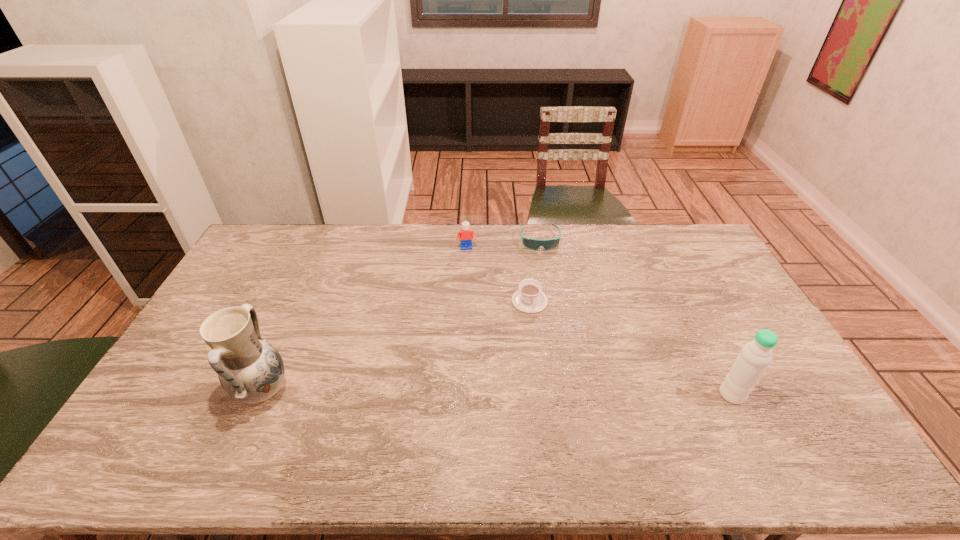
This screenshot has width=960, height=540. In order to click on free area in between the Lego and the rightmost object in this screenshot , I will do `click(599, 321)`.

The height and width of the screenshot is (540, 960). I want to click on free point between the sunglasses and the third shortest object, so click(503, 244).

What are the coordinates of `free space between the fourth object from right to left and the teacup` in the screenshot? It's located at (498, 274).

Image resolution: width=960 pixels, height=540 pixels. Identify the location of free point between the Lego and the water bottle. (599, 321).

Identify the location of free space between the pottery and the third farthest object. The image size is (960, 540). (396, 346).

Where is `empty location between the Lego and the sunglasses`? empty location between the Lego and the sunglasses is located at coordinates (503, 244).

The width and height of the screenshot is (960, 540). I want to click on vacant area that lies between the second tallest object and the second object from left to right, so click(x=599, y=321).

The height and width of the screenshot is (540, 960). Find the location of `free space between the Lego and the fourth shortest object`. free space between the Lego and the fourth shortest object is located at coordinates (599, 321).

You are a GUI agent. You are given a task and a screenshot of the screen. Output one action in this format:
    pyautogui.click(x=<x>, y=<y>)
    Task: Click on the object that stands as the third closest to the third nearest object
    This screenshot has width=960, height=540.
    Given the screenshot: What is the action you would take?
    pyautogui.click(x=751, y=363)

Find the location of a particular element. The width and height of the screenshot is (960, 540). object that stands as the fourth closest to the pottery is located at coordinates (751, 363).